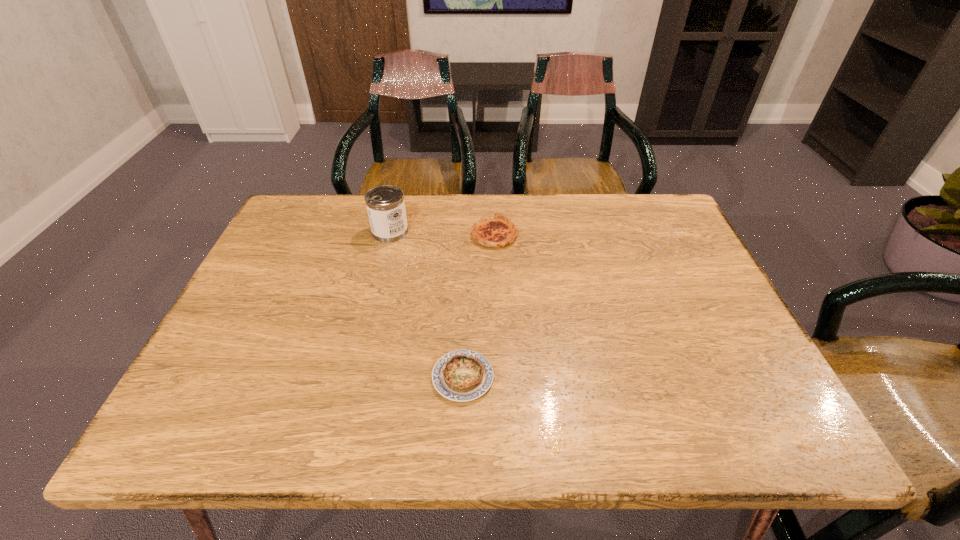
Identify the location of free spot that satisfies the following two spatial constraints: 1. on the back side of the shorter quiche; 2. on the left side of the second tallest object. The image size is (960, 540). [x=468, y=235].